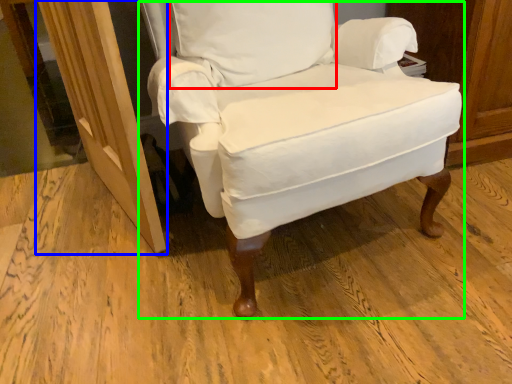
Question: Based on their relative distances, which object is nearer to pillow (highlighted by a red box)? Choose from screen door (highlighted by a blue box) and chair (highlighted by a green box).

Choices:
 (A) screen door
 (B) chair

Answer: (B)